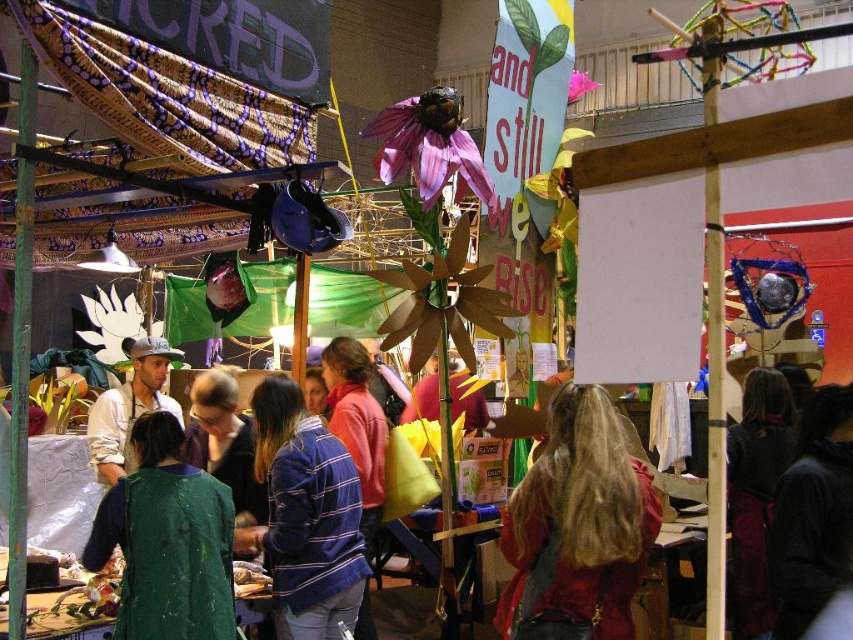
Question: Among these points, which one is farthest from the camera?

Choices:
 (A) (102, 477)
 (B) (113, 547)
 (C) (529, 522)
 (D) (334, 529)

Answer: (A)

Question: Is blonde hair at center positioned before green fabric jacket at lower left?

Choices:
 (A) no
 (B) yes

Answer: (A)

Question: Which point appears farthest from the camera in this image?

Choices:
 (A) tap(105, 481)
 (B) tap(344, 592)
 (C) tap(618, 531)
 (D) tap(144, 634)

Answer: (A)

Question: Is green fabric jacket at lower left smaller than matte white cap at center?

Choices:
 (A) yes
 (B) no

Answer: (A)

Question: Is striped fleece jacket at center above matte white cap at center?

Choices:
 (A) yes
 (B) no

Answer: (B)

Question: Which point is farther to the camera?

Choices:
 (A) matte white cap at center
 (B) striped fleece jacket at center
 (C) blonde hair at center
 (D) green fabric jacket at lower left

Answer: (A)